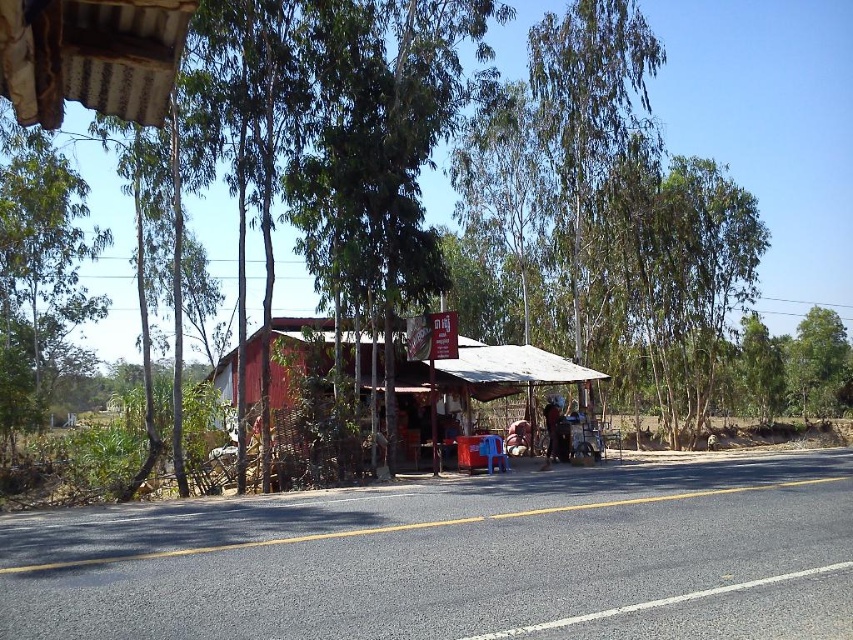
Consider the image. Please provide the 2D coordinates of the white corrugated metal roof at upper left in the image. The answer should be in the format of coordinates in parentheses.

The 2D coordinates of the white corrugated metal roof at upper left are at point [90,56].

You are standing at the center of the image and want to move towards the green leafy tree at left. Which direction should you face?

The green leafy tree at left is located at point (x=39, y=272), which means it is positioned to the left side of the image. To face the tree, you should turn to your left direction.

You are a customer looking to buy a cold drink from the stall. The red wooden hut at center has a cooler box, but you notice the white corrugated metal roof at upper left might be casting a shadow. Which object would provide more shade for you to stay cool?

The red wooden hut at center provides more shade because it is larger than the white corrugated metal roof at upper left, which is smaller.